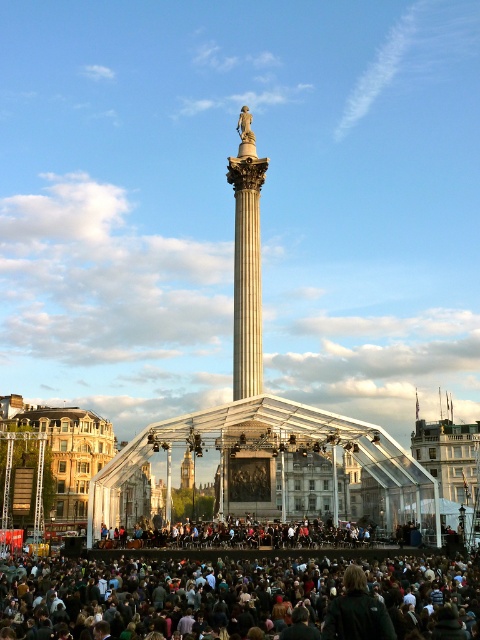
Please look at the image and focus on the point with coordinates (236, 598). What can you see at that exact location?

At the point with coordinates (236, 598), you can see dark brown hair at lower center.

You are a photographer standing at the edge of the square. You want to take a photo of the white marble column at center without any people in the frame. Is the dark brown hair at lower center blocking your view of the column?

The dark brown hair at lower center is in front of the white marble column at center, so it is blocking the view of the column. You would need to move to a different angle or wait for the person to move to capture the column without obstruction.

You are standing in the public square and want to take a photo of both the column and the pavilion. You notice two points marked in the image at coordinates point (x=156, y=621) and point (x=241, y=141). Since you want to ensure both are in focus, which point should you focus on to capture both effectively?

You should focus on point (x=241, y=141) because it is farther from the camera than point (x=156, y=621). By focusing on the farther point, the closer point will also be within the depth of field, ensuring both are in focus.